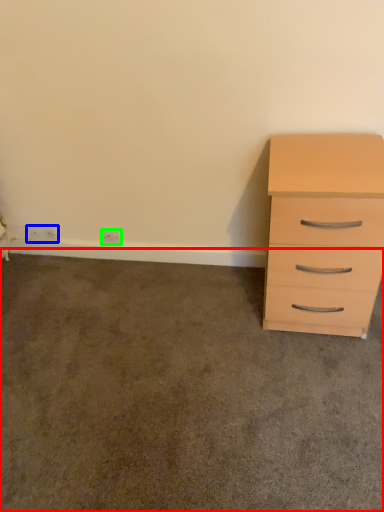
Question: Based on their relative distances, which object is nearer to concrete (highlighted by a red box)? Choose from electric outlet (highlighted by a blue box) and electric outlet (highlighted by a green box).

Choices:
 (A) electric outlet
 (B) electric outlet

Answer: (B)